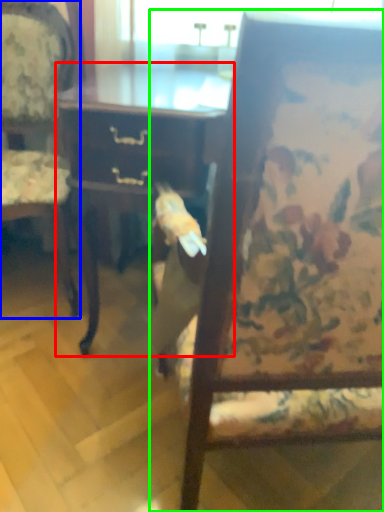
Question: Which is farther away from desk (highlighted by a red box)? chair (highlighted by a blue box) or chair (highlighted by a green box)?

Choices:
 (A) chair
 (B) chair

Answer: (B)